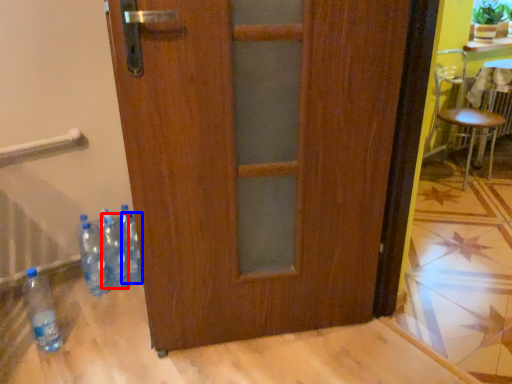
Question: Which of the following is the closest to the observer, bottle (highlighted by a red box) or bottle (highlighted by a blue box)?

Choices:
 (A) bottle
 (B) bottle

Answer: (A)